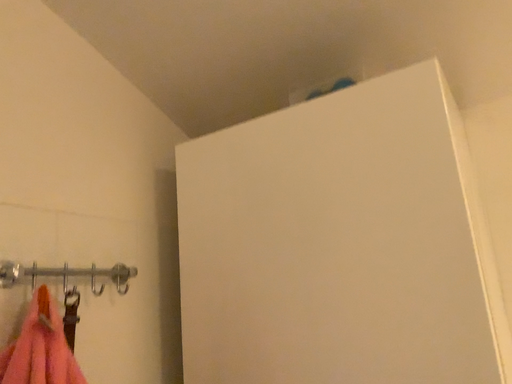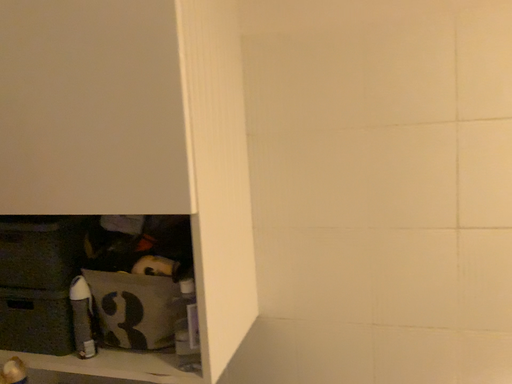
Question: How did the camera likely rotate when shooting the video?

Choices:
 (A) rotated upward
 (B) rotated downward

Answer: (B)